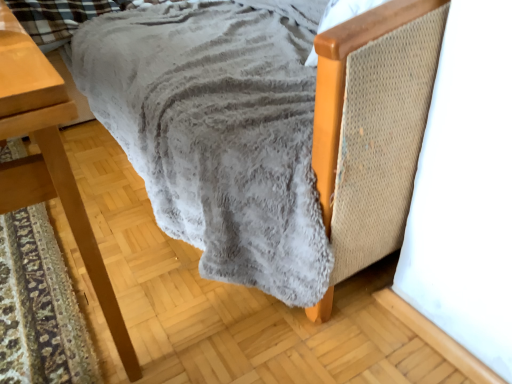
The height and width of the screenshot is (384, 512). What are the coordinates of `wooden table at left` in the screenshot? It's located at (49, 160).

Measure the distance between point (42,121) and camera.

Point (42,121) is 17.72 inches away from camera.

What is the approximate width of wooden table at left?

The width of wooden table at left is 10.62 inches.

The image size is (512, 384). What do you see at coordinates (49, 160) in the screenshot?
I see `wooden table at left` at bounding box center [49, 160].

In order to face wooden table at left, should I rotate leftwards or rightwards?

Rotate your view left by about 31.357°.

The height and width of the screenshot is (384, 512). Identify the location of wooden table at left. (49, 160).